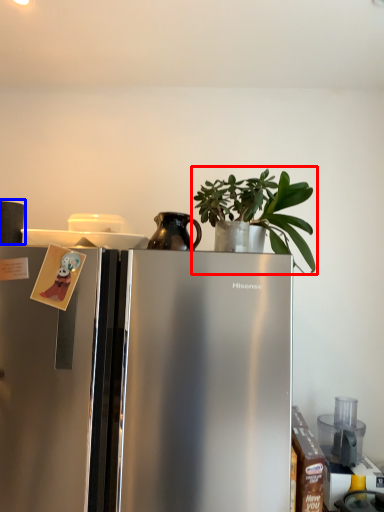
Question: Which object appears closest to the camera in this image, houseplant (highlighted by a red box) or appliance (highlighted by a blue box)?

Choices:
 (A) houseplant
 (B) appliance

Answer: (A)